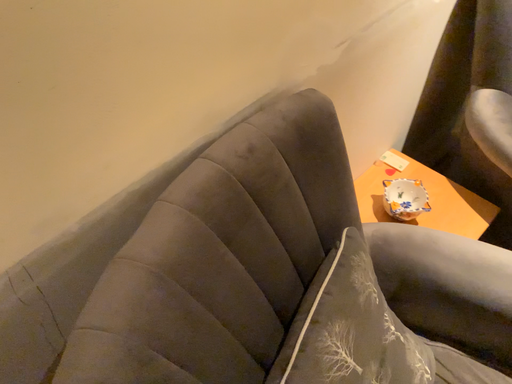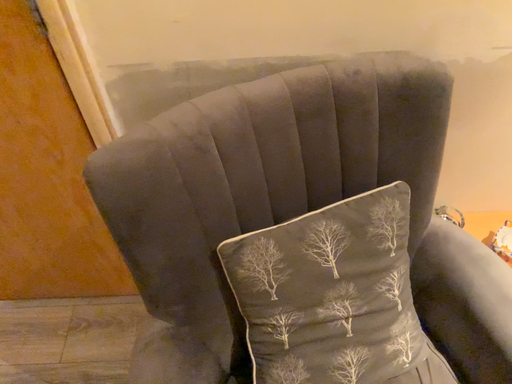
Question: Which way did the camera rotate in the video?

Choices:
 (A) rotated right
 (B) rotated left

Answer: (B)